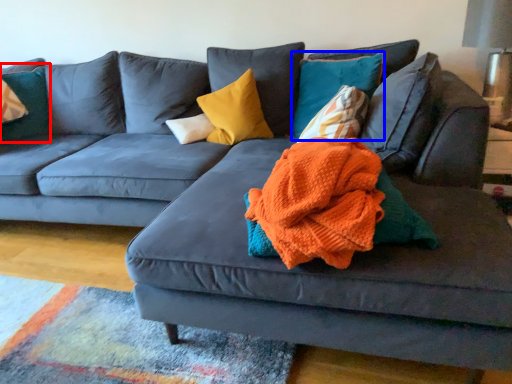
Question: Which of the following is the farthest to the observer, pillow (highlighted by a red box) or pillow (highlighted by a blue box)?

Choices:
 (A) pillow
 (B) pillow

Answer: (A)